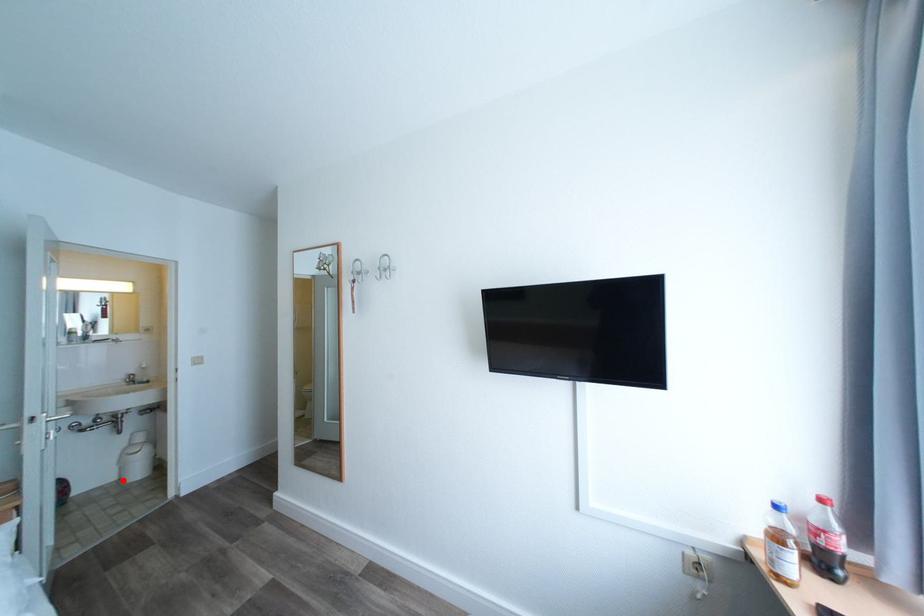
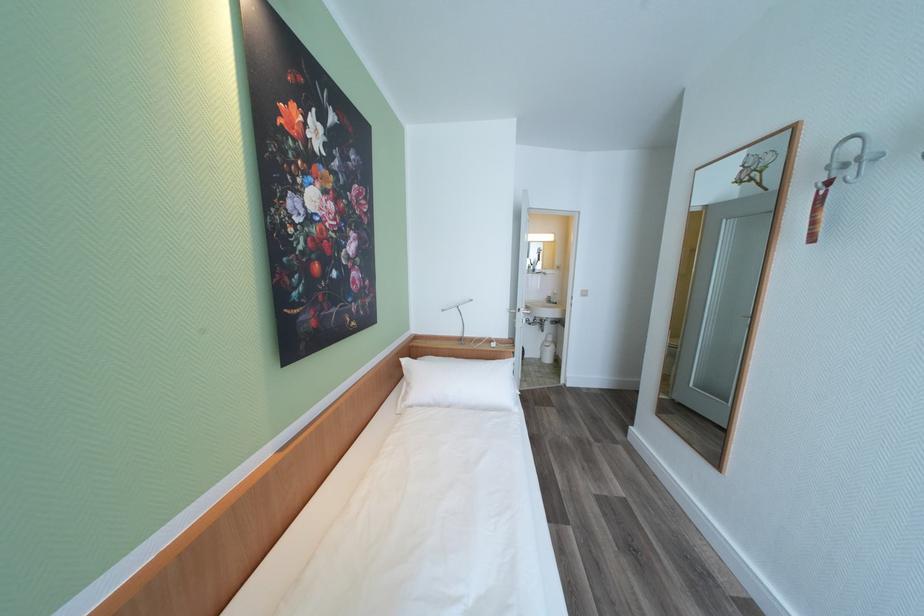
Question: I am providing you with two images of the same scene from different viewpoints. In image1, a red point is highlighted. Considering the same 3D point in image2, which of the following is correct?

Choices:
 (A) It is closer
 (B) It is farther

Answer: (B)